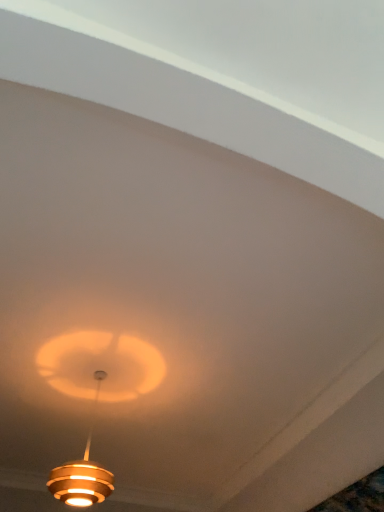
Measure the distance between point (82, 490) and camera.

They are 8.26 feet apart.

This screenshot has height=512, width=384. I want to click on gold metallic lamp at center, so click(82, 472).

This screenshot has height=512, width=384. What do you see at coordinates (82, 472) in the screenshot?
I see `gold metallic lamp at center` at bounding box center [82, 472].

This screenshot has width=384, height=512. I want to click on gold metallic lamp at center, so click(x=82, y=472).